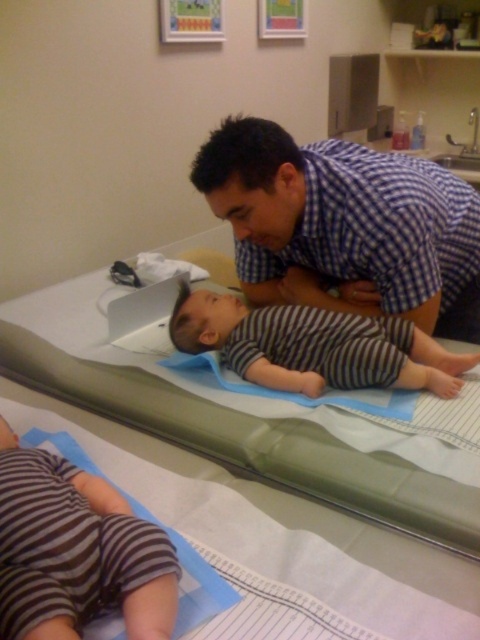
You are a nurse in the medical examination room. You need to locate the blue checkered shirt at upper center and the green fabric bed at upper center. Which object is positioned to the right side of the room?

The blue checkered shirt at upper center is positioned to the right of the green fabric bed at upper center, so the blue checkered shirt at upper center is on the right side of the room.

You are a nurse standing in the examination room and need to reach the green fabric bed at upper center to check on the baby. The nurse is 5 feet 6 inches tall. Can you safely reach the bed without needing a stool?

The green fabric bed at upper center is 31.41 inches away from the viewer. Since the nurse is 5 feet 6 inches tall, they can likely reach the bed comfortably without needing a stool, as the distance is within a typical reach range for someone of that height.

You are a healthcare professional preparing to take measurements in the examination room. You need to determine which clothing item has a greater width between the blue checkered shirt at upper center and the striped cotton pants at lower left to decide which one might interfere more with the measurements. Which clothing item has a greater width?

The blue checkered shirt at upper center has a greater width than the striped cotton pants at lower left, so it might interfere more with the measurements.